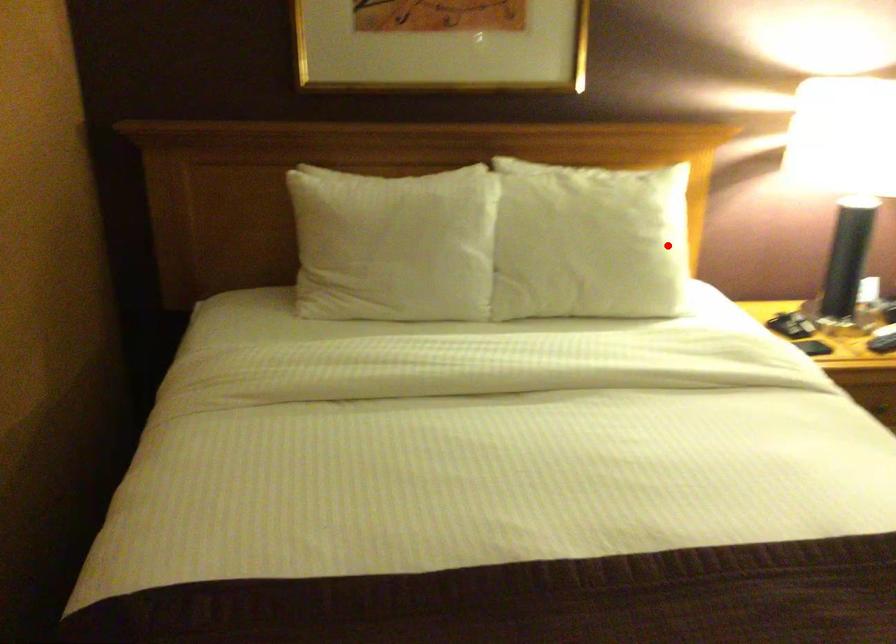
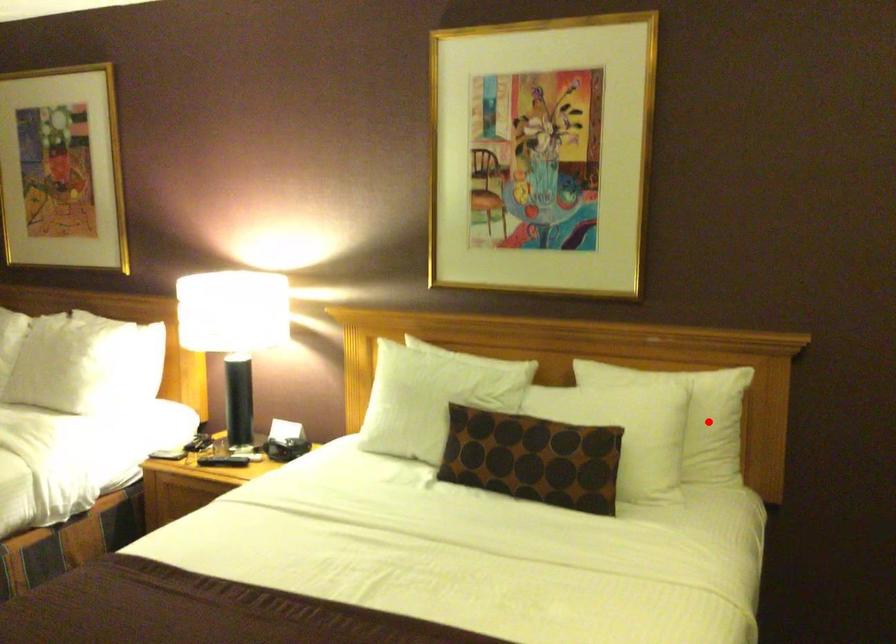
I am providing you with two images of the same scene from different viewpoints. A red point is marked on the first image and another point is marked on the second image. Do the highlighted points in image1 and image2 indicate the same real-world spot?

No